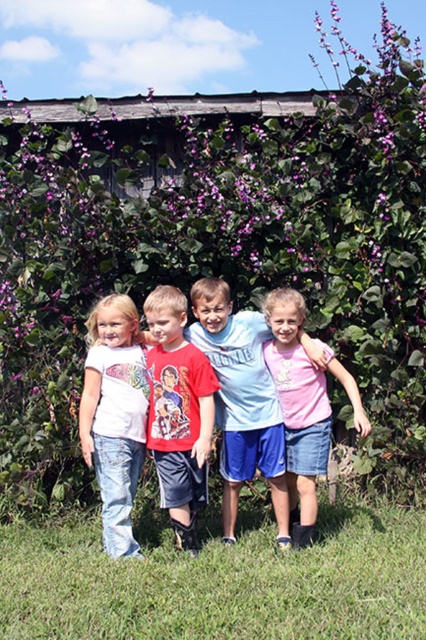
Question: Estimate the real-world distances between objects in this image. Which object is farther from the pink cotton shirt at center?

Choices:
 (A) light blue cotton shirt at center
 (B) red cotton t-shirt at center
 (C) white denim jeans at left

Answer: (C)

Question: Is the position of white denim jeans at left less distant than that of pink cotton shirt at center?

Choices:
 (A) yes
 (B) no

Answer: (A)

Question: Considering the relative positions of light blue cotton shirt at center and pink cotton shirt at center in the image provided, where is light blue cotton shirt at center located with respect to pink cotton shirt at center?

Choices:
 (A) above
 (B) below

Answer: (B)

Question: Which point is farther to the camera?

Choices:
 (A) (284, 541)
 (B) (189, 576)
 (C) (131, 451)
 (D) (169, 396)

Answer: (A)

Question: Among these points, which one is nearest to the camera?

Choices:
 (A) (170, 408)
 (B) (115, 524)
 (C) (328, 445)

Answer: (B)

Question: Does white denim jeans at left have a greater width compared to red cotton t-shirt at center?

Choices:
 (A) yes
 (B) no

Answer: (A)